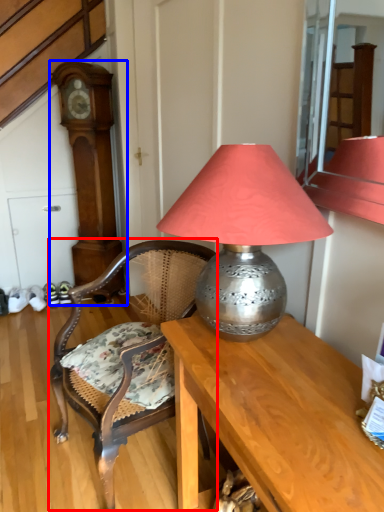
Question: Which of the following is the closest to the observer, chair (highlighted by a red box) or clock (highlighted by a blue box)?

Choices:
 (A) chair
 (B) clock

Answer: (A)